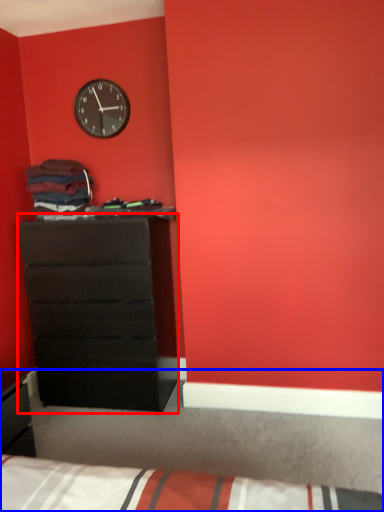
Question: Which of the following is the farthest to the observer, chest of drawers (highlighted by a red box) or bed (highlighted by a blue box)?

Choices:
 (A) chest of drawers
 (B) bed

Answer: (A)